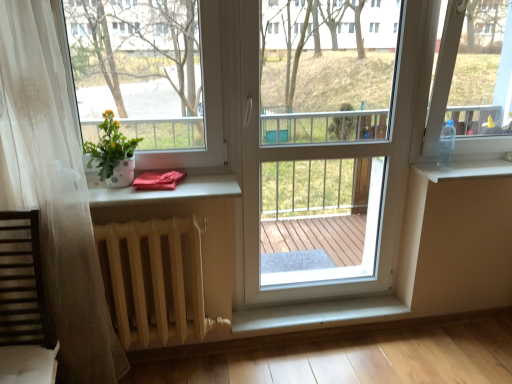
Question: Looking at their shapes, would you say white plastic screen door at center is wider or thinner than white glossy pot at left?

Choices:
 (A) thin
 (B) wide

Answer: (A)

Question: Is white plastic screen door at center inside the boundaries of white glossy pot at left, or outside?

Choices:
 (A) outside
 (B) inside

Answer: (A)

Question: Which object is the closest to the white glossy pot at left?

Choices:
 (A) white plastic screen door at center
 (B) wooden slats rocking chair at lower left
 (C) white painted wood radiator at center
 (D) white glossy flower pot at left, which is the 1th window screen from left to right
 (E) white plastic window sill at right

Answer: (D)

Question: Which of these objects is positioned farthest from the transparent plastic bottle at right, positioned as the first window screen in right-to-left order?

Choices:
 (A) white plastic window sill at right
 (B) white glossy flower pot at left, which is counted as the 2th window screen, starting from the right
 (C) white plastic screen door at center
 (D) wooden slats rocking chair at lower left
 (E) white glossy pot at left

Answer: (D)